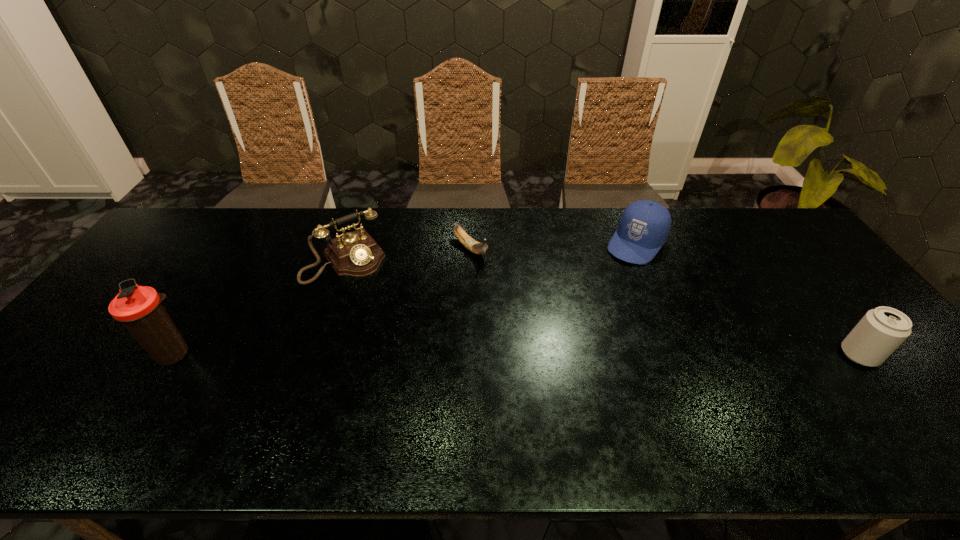
Find the location of a particular element. The image size is (960, 540). cap located in the far edge section of the desktop is located at coordinates (644, 226).

The height and width of the screenshot is (540, 960). I want to click on object present at the right edge, so click(x=882, y=330).

The height and width of the screenshot is (540, 960). Find the location of `vacant region at the far edge`. vacant region at the far edge is located at coordinates (444, 223).

Identify the location of free location at the near edge of the desktop. This screenshot has width=960, height=540. tap(758, 406).

Where is `vacant space at the left edge`? The height and width of the screenshot is (540, 960). vacant space at the left edge is located at coordinates [128, 275].

The height and width of the screenshot is (540, 960). Identify the location of free region at the right edge of the desktop. (785, 283).

Find the location of a particular element. free region at the near left corner of the desktop is located at coordinates (80, 390).

In the image, there is a desktop. Identify the location of vacant space at the far right corner. The width and height of the screenshot is (960, 540). (740, 221).

You are a GUI agent. You are given a task and a screenshot of the screen. Output one action in this format:
    pyautogui.click(x=<x>, y=<y>)
    Task: Click on the blank region between the rightmost object and the leftmost object
    
    Given the screenshot: What is the action you would take?
    pyautogui.click(x=516, y=355)

The height and width of the screenshot is (540, 960). I want to click on vacant area that lies between the thermos bottle and the second object from right to left, so click(x=405, y=299).